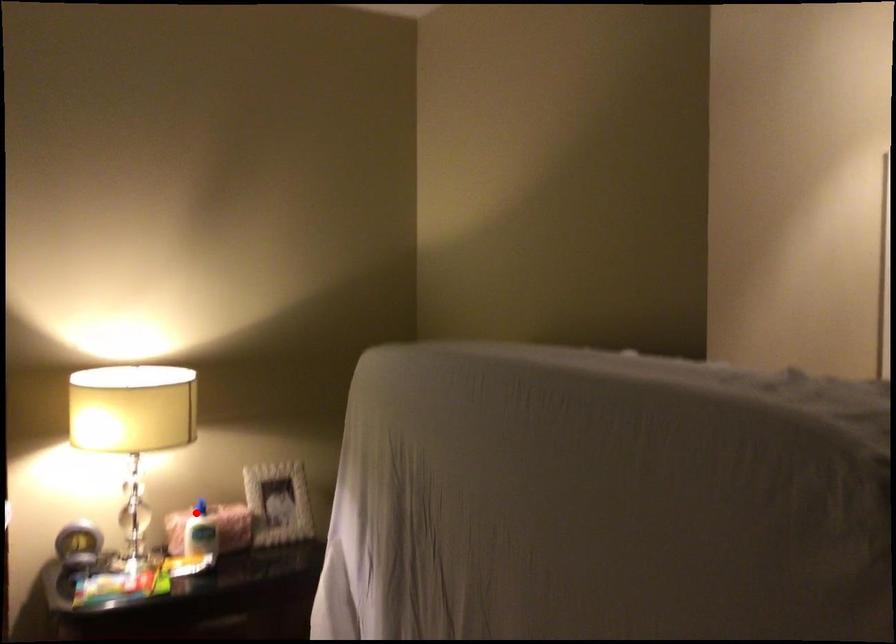
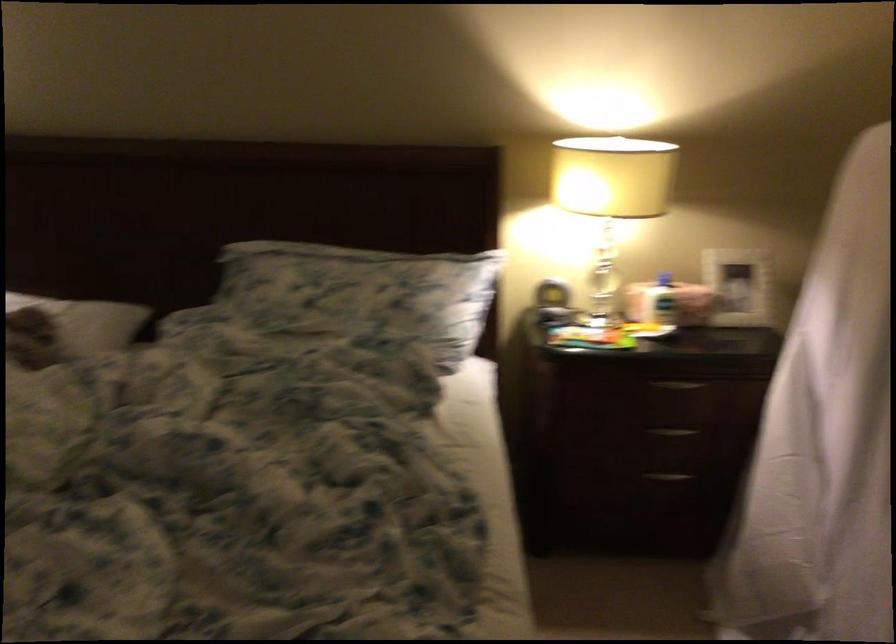
The point at the highlighted location is marked in the first image. Where is the corresponding point in the second image?

(664, 279)